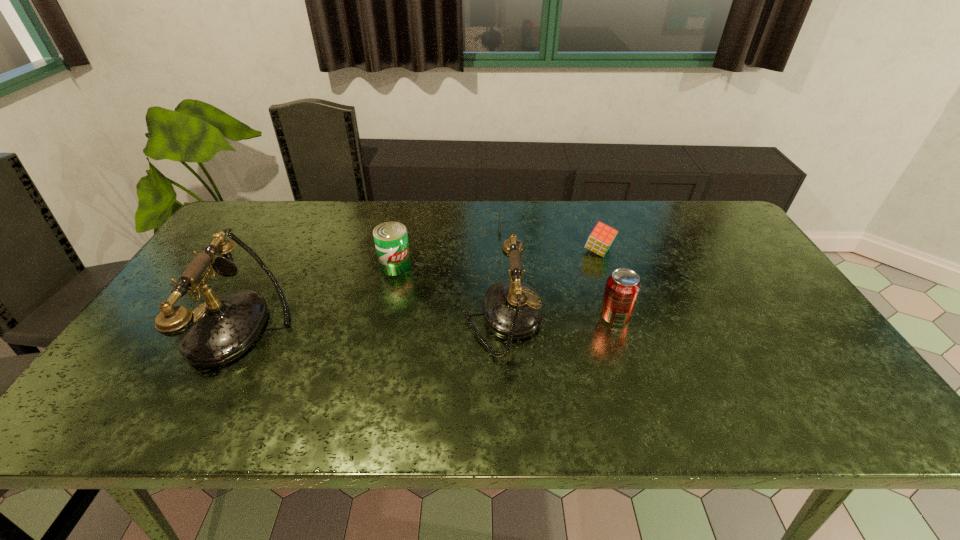
Locate an element on the screen. object that is at the near left corner is located at coordinates (220, 330).

Where is `vacant space at the far edge of the desktop`? Image resolution: width=960 pixels, height=540 pixels. vacant space at the far edge of the desktop is located at coordinates (330, 206).

Where is `free spot at the near edge of the desktop`? The image size is (960, 540). free spot at the near edge of the desktop is located at coordinates (697, 375).

The width and height of the screenshot is (960, 540). In the image, there is a desktop. What are the coordinates of `vacant space at the right edge` in the screenshot? It's located at pos(728,264).

The image size is (960, 540). In the image, there is a desktop. Find the location of `vacant region at the far left corner`. vacant region at the far left corner is located at coordinates (267, 222).

Where is `vacant region at the far right corner`? The width and height of the screenshot is (960, 540). vacant region at the far right corner is located at coordinates (689, 227).

Where is `free point between the sunglasses and the soda can`? free point between the sunglasses and the soda can is located at coordinates (564, 271).

Find the location of a particular element. The image size is (960, 540). free space between the second tallest object and the second shortest object is located at coordinates (550, 285).

The image size is (960, 540). Find the location of `empty space between the left telephone and the cube`. empty space between the left telephone and the cube is located at coordinates (421, 288).

Identify the location of unoccupied position between the tallest object and the soda can. This screenshot has height=540, width=960. (430, 320).